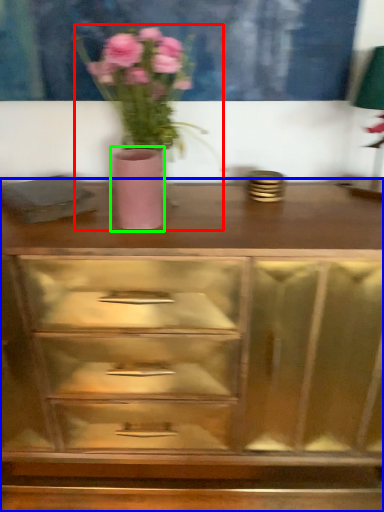
Question: Estimate the real-world distances between objects in this image. Which object is farther from floral arrangement (highlighted by a red box), chest of drawers (highlighted by a blue box) or vase (highlighted by a green box)?

Choices:
 (A) chest of drawers
 (B) vase

Answer: (A)